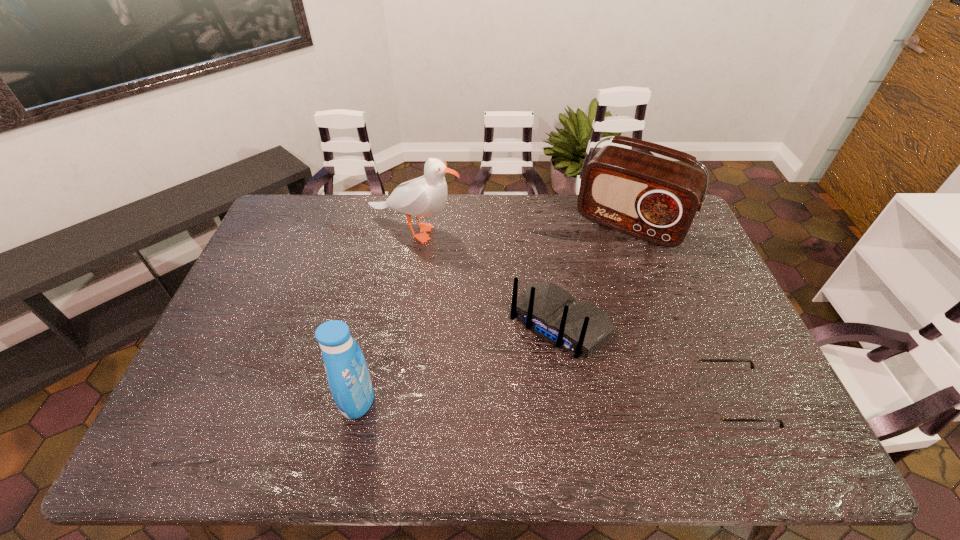
Where is `vacant area situated on the back of the router`? The height and width of the screenshot is (540, 960). vacant area situated on the back of the router is located at coordinates (491, 404).

Image resolution: width=960 pixels, height=540 pixels. Find the location of `gull present at the far edge`. gull present at the far edge is located at coordinates pos(424,196).

This screenshot has height=540, width=960. In order to click on radio receiver at the far edge in this screenshot , I will do `click(654, 199)`.

Find the location of a particular element. detergent present at the near edge is located at coordinates (347, 373).

Where is `spectacles located at the near edge`? This screenshot has height=540, width=960. spectacles located at the near edge is located at coordinates (712, 408).

You are a GUI agent. You are given a task and a screenshot of the screen. Output one action in this format:
    pyautogui.click(x=<x>, y=<y>)
    Task: Click on the spectacles present at the right edge
    This screenshot has width=960, height=540.
    Given the screenshot: What is the action you would take?
    pyautogui.click(x=712, y=408)

The width and height of the screenshot is (960, 540). Find the location of `radio receiver located at the right edge`. radio receiver located at the right edge is located at coordinates (654, 199).

The height and width of the screenshot is (540, 960). In order to click on object present at the far right corner in this screenshot , I will do `click(654, 199)`.

You are a GUI agent. You are given a task and a screenshot of the screen. Output one action in this format:
    pyautogui.click(x=<x>, y=<y>)
    Task: Click on the object at the near right corner
    The height and width of the screenshot is (540, 960).
    Given the screenshot: What is the action you would take?
    pyautogui.click(x=712, y=408)

Locate an element on the screen. The width and height of the screenshot is (960, 540). free space at the far edge of the desktop is located at coordinates (436, 214).